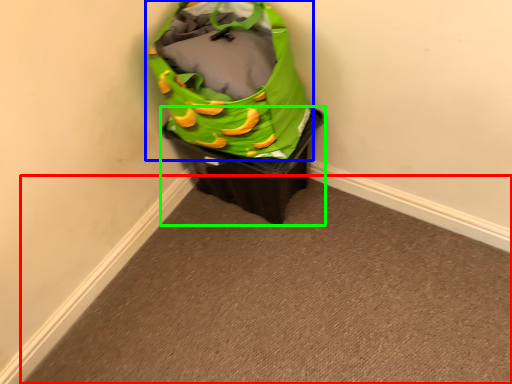
Question: Based on their relative distances, which object is nearer to plain (highlighted by a red box)? Choose from luggage and bags (highlighted by a blue box) and waste container (highlighted by a green box).

Choices:
 (A) luggage and bags
 (B) waste container

Answer: (B)